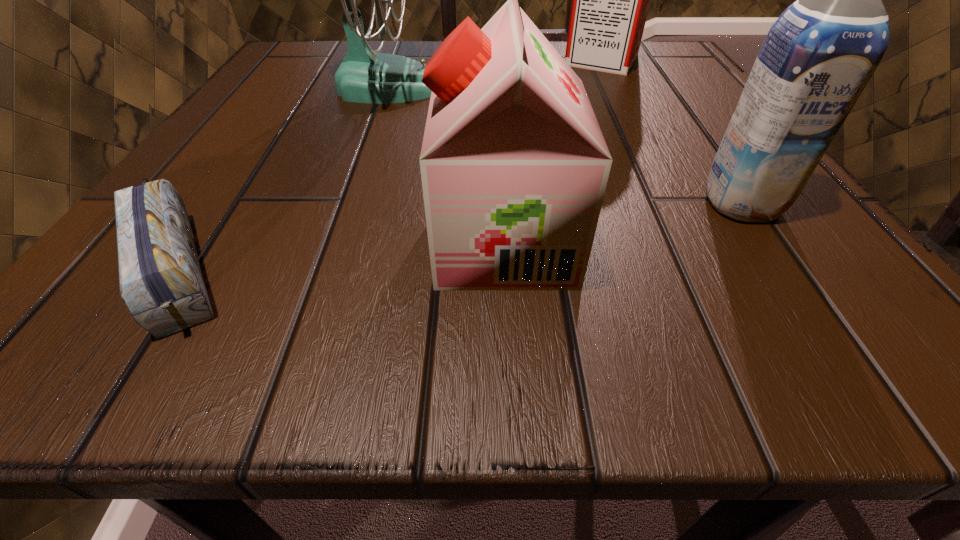
Identify which soya milk is the second closest to the pencil box. Please provide its 2D coordinates. Your answer should be formatted as a tuple, i.e. [(x, y)], where the tuple contains the x and y coordinates of a point satisfying the conditions above.

[(818, 56)]

Identify which soya milk is the second closest to the fan. Please provide its 2D coordinates. Your answer should be formatted as a tuple, i.e. [(x, y)], where the tuple contains the x and y coordinates of a point satisfying the conditions above.

[(610, 0)]

Identify the location of vacant space that satisfies the following two spatial constraints: 1. on the front side of the farthest soya milk; 2. in front of the fan, directing airflow. This screenshot has height=540, width=960. (615, 86).

Identify the location of vacant region that satisfies the following two spatial constraints: 1. on the front side of the farthest soya milk; 2. in front of the fan, directing airflow. The width and height of the screenshot is (960, 540). (615, 86).

Image resolution: width=960 pixels, height=540 pixels. Identify the location of free spot that satisfies the following two spatial constraints: 1. on the front side of the farthest soya milk; 2. with the cap open on the leftmost soya milk. (694, 241).